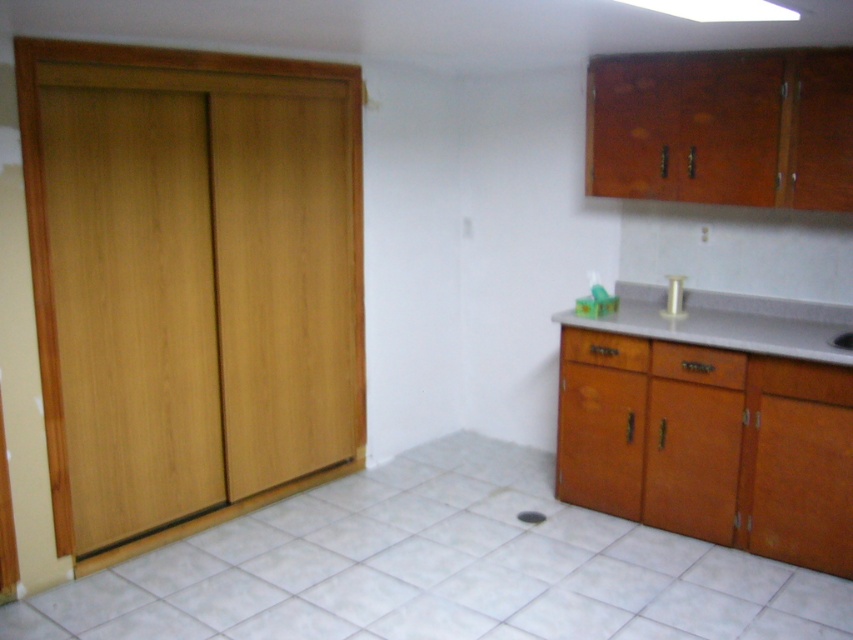
You are standing in the kitchen and want to place a small bowl on the smooth gray countertop at right. Based on the coordinates provided, is the point at (717, 426) on the smooth gray countertop at right?

Yes, the point at (717, 426) marks the smooth gray countertop at right, so placing the bowl there would be appropriate.

You are standing in the kitchen and want to place a 3.0 meter long table between yourself and the smooth gray countertop at right. Can the table fit without overlapping the countertop?

The smooth gray countertop at right is 2.90 meters away from you. Since the table is 3.0 meters long, it would extend beyond the countertop and overlap it, so the table cannot fit without overlapping the countertop.